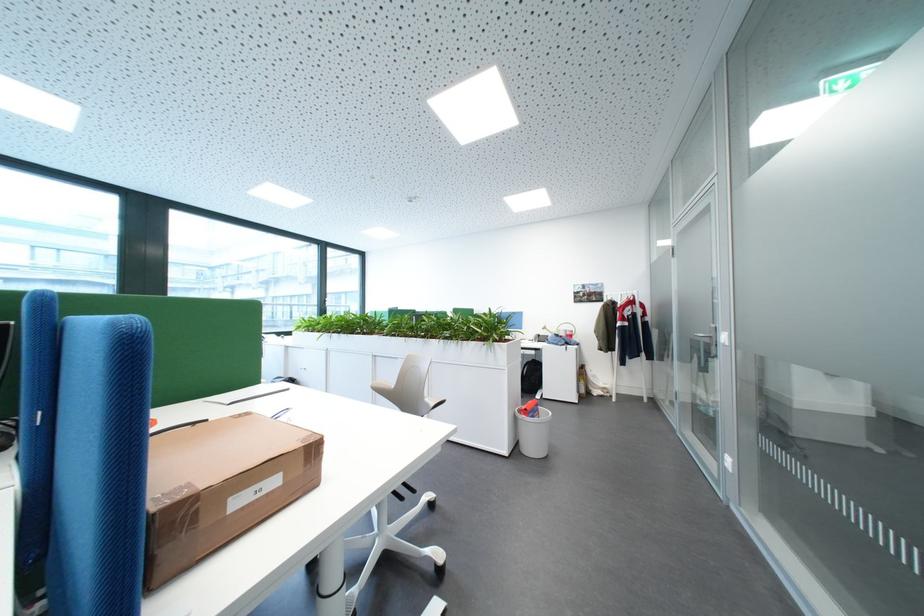
Find the location of a particular element. grey chair armrest is located at coordinates (100, 467).